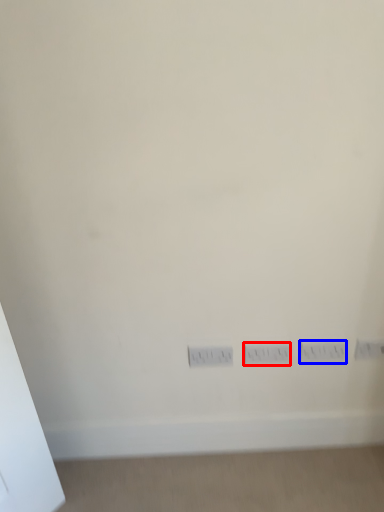
Question: Among these objects, which one is nearest to the camera, switch (highlighted by a red box) or electric outlet (highlighted by a blue box)?

Choices:
 (A) switch
 (B) electric outlet

Answer: (B)